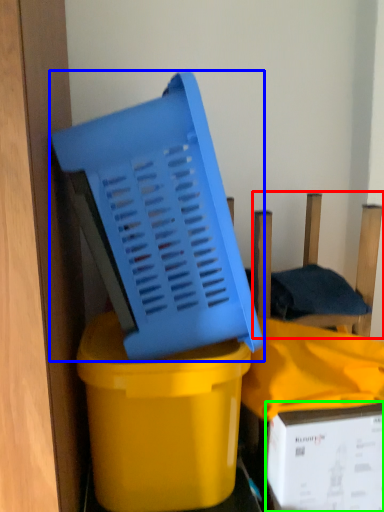
Question: Which object is the closest to the chair (highlighted by a red box)? Choose among these: basket (highlighted by a blue box) or box (highlighted by a green box).

Choices:
 (A) basket
 (B) box

Answer: (A)